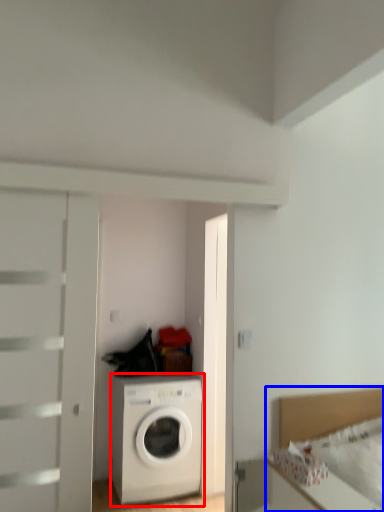
Question: Which object appears closest to the camera in this image, washing machine (highlighted by a red box) or bed (highlighted by a blue box)?

Choices:
 (A) washing machine
 (B) bed

Answer: (B)